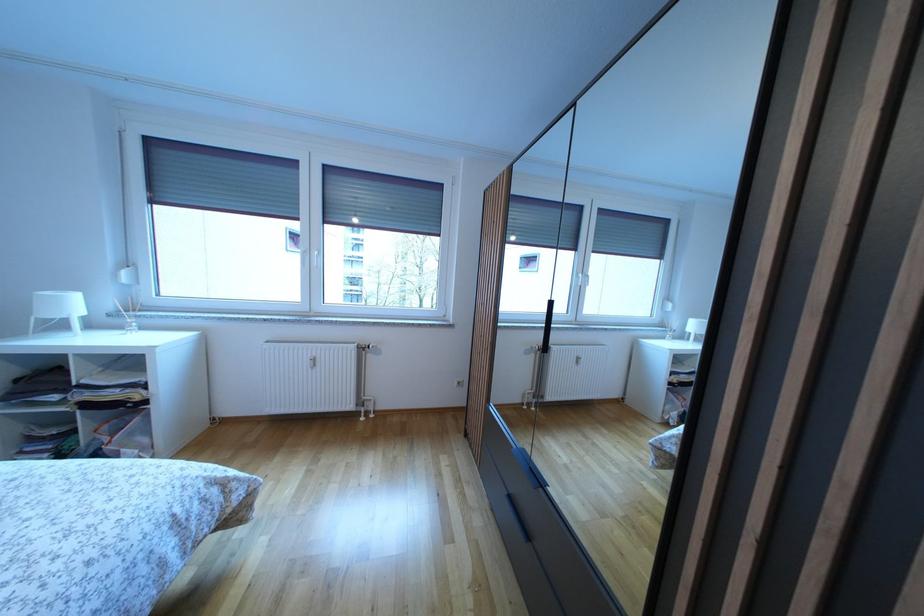
At what (x,y) coordinates should I click in order to perform the action: click on black vertical handle. Please return your answer as a coordinate pair (x, y). The width and height of the screenshot is (924, 616). Looking at the image, I should click on (546, 328).